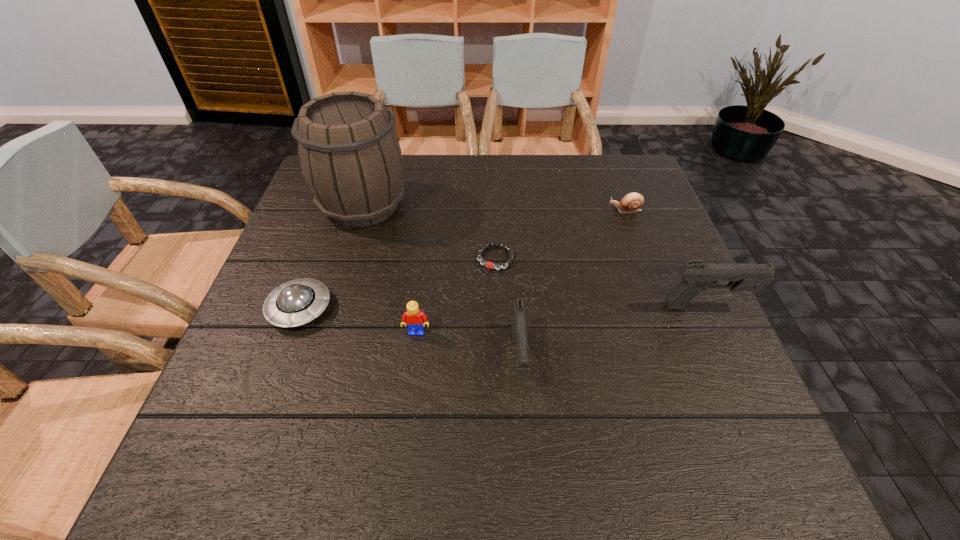
Locate an element on the screen. wine bucket positioned at the left edge is located at coordinates (349, 153).

The width and height of the screenshot is (960, 540). I want to click on saucer that is at the left edge, so click(297, 302).

At what (x,y) coordinates should I click in order to perform the action: click on pistol that is positioned at the right edge. Please return your answer as a coordinate pair (x, y). The image size is (960, 540). Looking at the image, I should click on (696, 277).

Where is `escargot positioned at the right edge`? escargot positioned at the right edge is located at coordinates (633, 201).

This screenshot has height=540, width=960. Identify the location of object that is at the far left corner. (349, 153).

The image size is (960, 540). Find the location of `vacant region at the far edge of the desktop`. vacant region at the far edge of the desktop is located at coordinates (545, 153).

Image resolution: width=960 pixels, height=540 pixels. Identify the location of vacant area at the near edge of the desktop. (329, 400).

This screenshot has height=540, width=960. I want to click on vacant space at the left edge of the desktop, so click(330, 223).

Identify the location of vacant space at the right edge of the desktop. (653, 283).

Find the location of a particular element. vacant area at the near left corner is located at coordinates (257, 402).